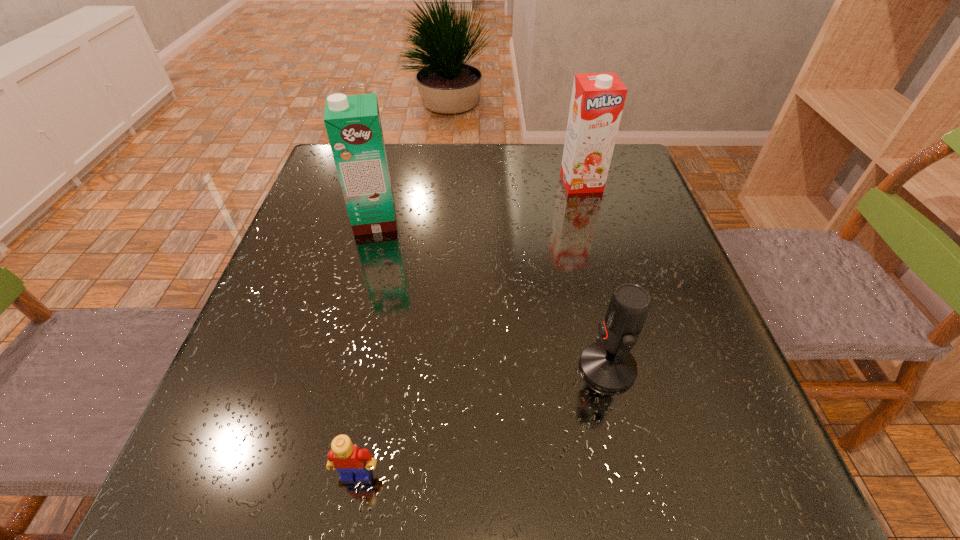
Where is `free space between the right carton and the microphone`? free space between the right carton and the microphone is located at coordinates (594, 275).

The height and width of the screenshot is (540, 960). Find the location of `free spot between the farthest object and the third farthest object`. free spot between the farthest object and the third farthest object is located at coordinates click(x=594, y=275).

This screenshot has width=960, height=540. Find the location of `empty space between the left carton and the Lego`. empty space between the left carton and the Lego is located at coordinates (366, 347).

Locate an element on the screen. free space that is in between the nearest object and the left carton is located at coordinates (366, 347).

Identify the location of vacant area between the second farthest object and the microphone. Image resolution: width=960 pixels, height=540 pixels. click(492, 294).

The image size is (960, 540). What are the coordinates of `vacant region between the third nearest object and the microphone` in the screenshot? It's located at (492, 294).

Locate an element on the screen. object that is the third closest to the microphone is located at coordinates (353, 124).

You are a GUI agent. You are given a task and a screenshot of the screen. Output one action in this format:
    pyautogui.click(x=<x>, y=<y>)
    Task: Click on the third closest object to the microphone
    
    Given the screenshot: What is the action you would take?
    pyautogui.click(x=353, y=124)

The image size is (960, 540). I want to click on free space in the image that satisfies the following two spatial constraints: 1. on the side of the microphone with the red ring; 2. on the face of the nearest object, so click(633, 474).

At what (x,y) coordinates should I click in order to perform the action: click on vacant space that satisfies the following two spatial constraints: 1. on the front side of the farthest object; 2. on the side of the second shortest object with the red ring. Please return your answer as a coordinate pair (x, y). The height and width of the screenshot is (540, 960). Looking at the image, I should click on click(633, 367).